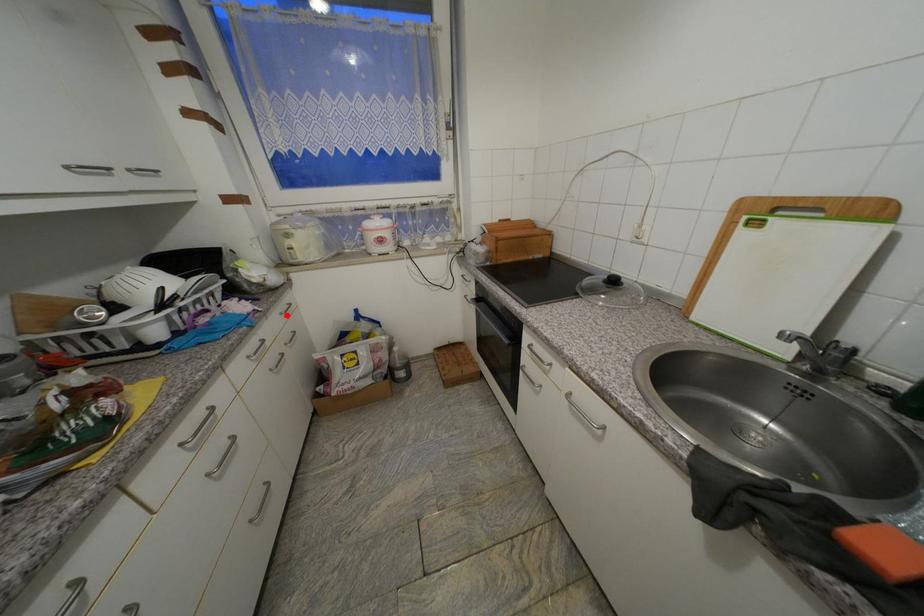
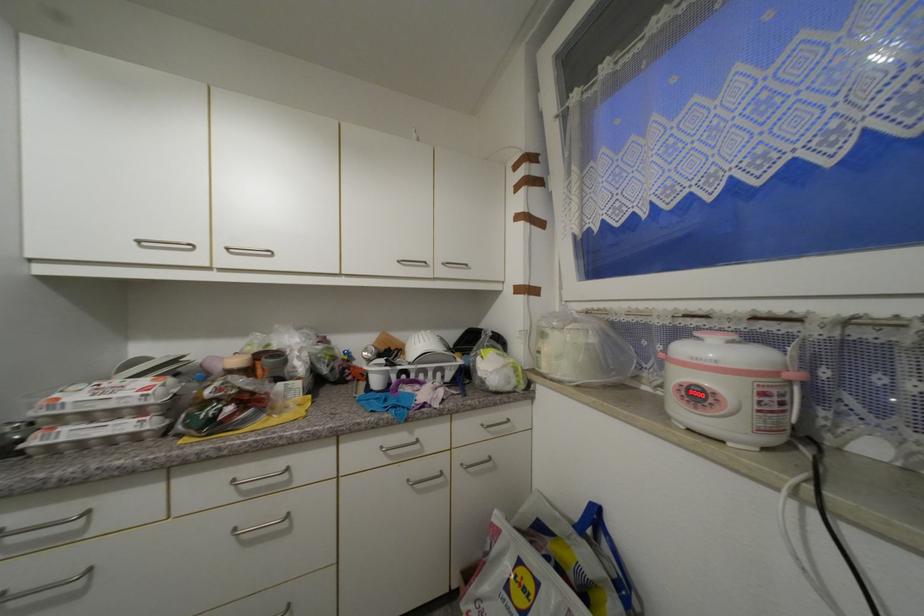
Question: I am providing you with two images of the same scene from different viewpoints. A red point is marked on the first image. Can you still see the location of the red point in image 2?

Choices:
 (A) Yes
 (B) No

Answer: (A)